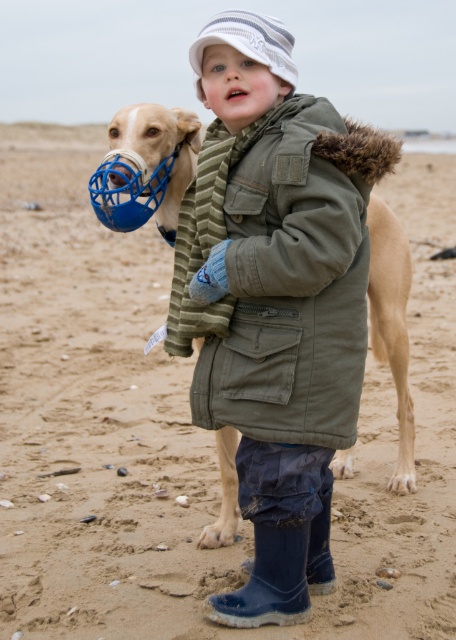
You are a photographer trying to capture the child and dog in the scene. The white striped knit cap at upper center and the blue rubber nose at center are both in the frame. Which object appears taller in the photo?

The white striped knit cap at upper center appears taller in the photo since it has a greater height compared to the blue rubber nose at center.

You are a photographer trying to capture the child and the dog in the scene. The white striped knit cap at upper center is represented by point (247, 42). Where should you position your camera to ensure the cap is in the upper center of your photo?

Position your camera so that the point (247, 42) representing the white striped knit cap at upper center is centered in the upper portion of your viewfinder.

You are standing at the beach and see two points marked on the sand. The first point is at coordinates point (x=342, y=380) and the second point is at point (x=250, y=93). Which point is closer to you?

Point (x=342, y=380) is further to the viewer than point (x=250, y=93), so the point closer to you is point (x=250, y=93).